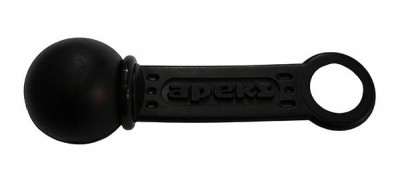
Find the location of `handle`. handle is located at coordinates (265, 71).